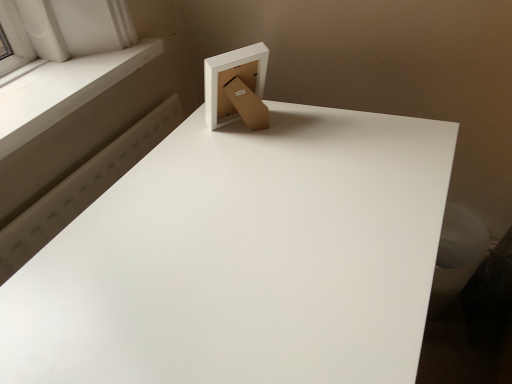
What are the coordinates of `free space to the right of matte cardboard box at upper center` in the screenshot? It's located at (318, 130).